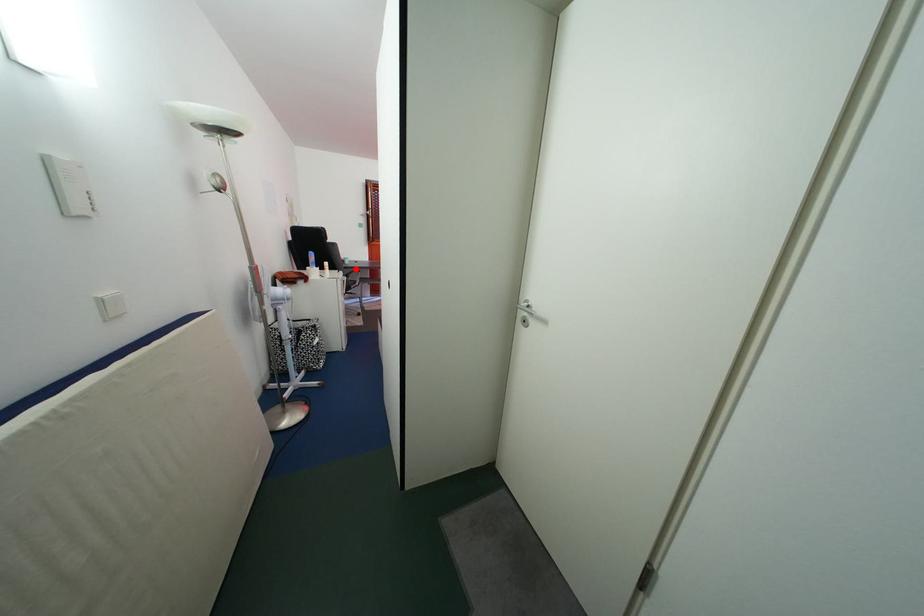
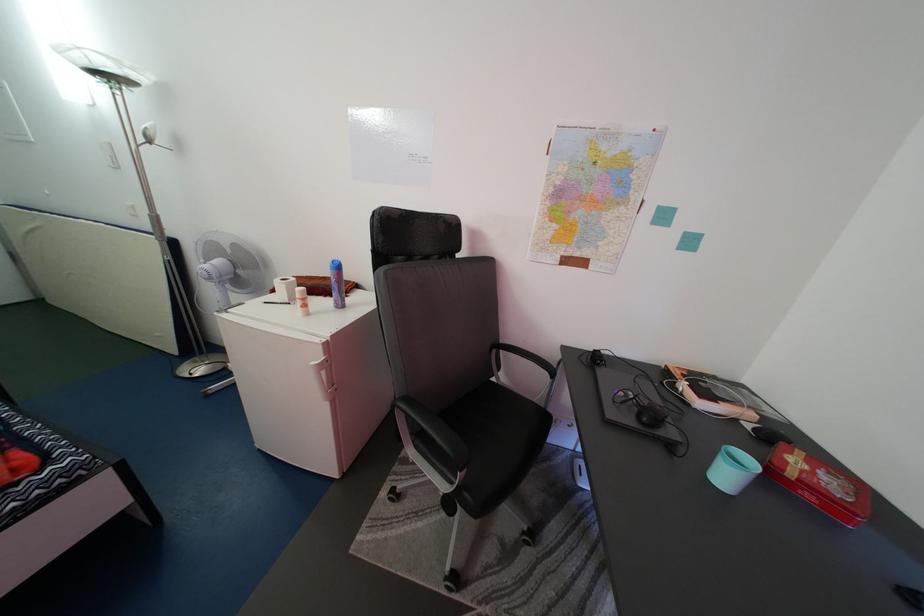
Question: I am providing you with two images of the same scene from different viewpoints. Given a red point in image1, look at the same physical point in image2. Is it:

Choices:
 (A) Closer to the viewpoint
 (B) Farther from the viewpoint

Answer: (B)